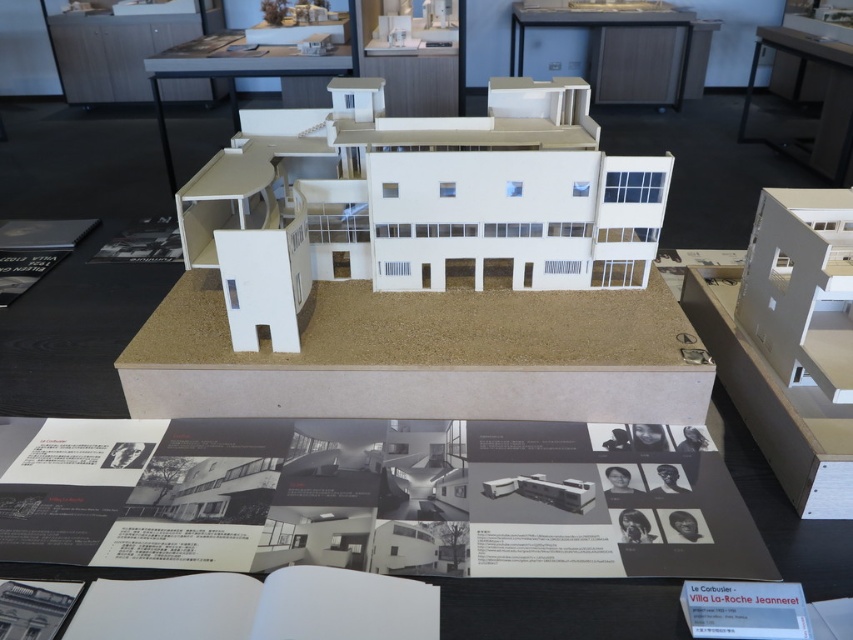
You are an architect examining the architectural model of the modernist building. You notice two points marked on the model at coordinates point (x=608, y=12) and point (x=831, y=161). Which point is closer to your line of sight?

Point (x=608, y=12) is further to the viewer than point (x=831, y=161). Wait, the description says the opposite. Let me check again. The Objects Description states that point (x=608, y=12) is further to the viewer than point (x=831, y=161). Therefore, the closer point to the viewer would be point (x=831, y=161). So the answer should be that point (x=831, y=161) is closer. Hmm, but the user might have made a mistake in the description. Wait, no, according to the given Objects Description, it says point (x=608, y=12) is

In the scene shown: You are standing in front of an architectural model and want to place a small decorative item on the light brown wooden table at upper center. Given that the table is represented by the point coordinates point [625,49], can you confirm the exact location where you should place the item?

The light brown wooden table at upper center is exactly at point [625,49], so you should place the item there.